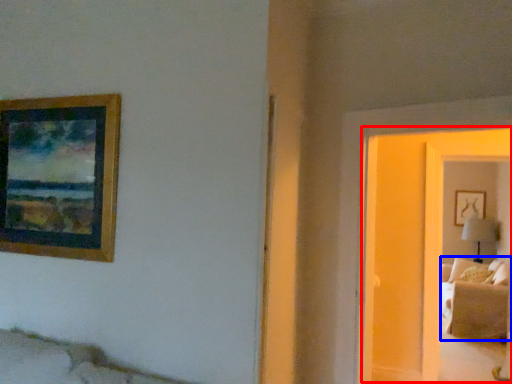
Question: Among these objects, which one is nearest to the camera, glass door (highlighted by a red box) or couch (highlighted by a blue box)?

Choices:
 (A) glass door
 (B) couch

Answer: (A)